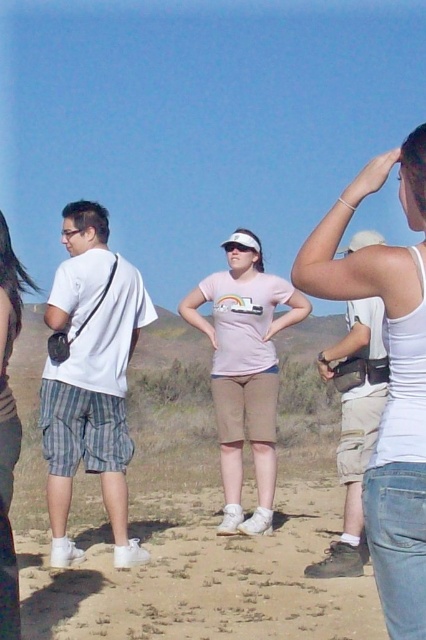
Question: Which of the following is the farthest from the observer?

Choices:
 (A) white tank top at upper right
 (B) khaki cargo shorts at right
 (C) matte white tank top at center
 (D) white cotton shirt at left

Answer: (D)

Question: Considering the real-world distances, which object is farthest from the white cotton shirt at left?

Choices:
 (A) pink matte t-shirt at center
 (B) white tank top at upper right
 (C) khaki cargo shorts at right

Answer: (B)

Question: Can you confirm if white cotton shirt at left is positioned below pink matte t-shirt at center?

Choices:
 (A) no
 (B) yes

Answer: (B)

Question: Which point appears closest to the camera in this image?

Choices:
 (A) (405, 381)
 (B) (362, 449)

Answer: (A)

Question: Is khaki cargo shorts at right above matte white tank top at center?

Choices:
 (A) no
 (B) yes

Answer: (A)

Question: In this image, where is pink matte t-shirt at center located relative to khaki cargo shorts at right?

Choices:
 (A) left
 (B) right

Answer: (A)